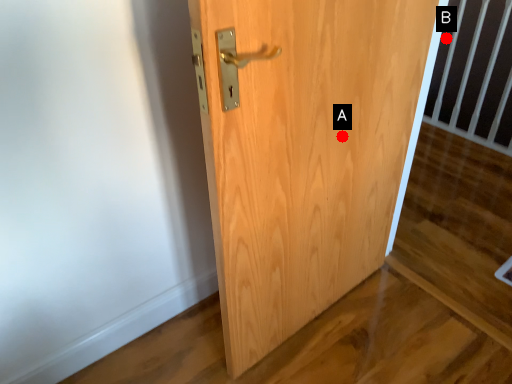
Question: Two points are circled on the image, labeled by A and B beside each circle. Among these points, which one is nearest to the camera?

Choices:
 (A) A is closer
 (B) B is closer

Answer: (A)